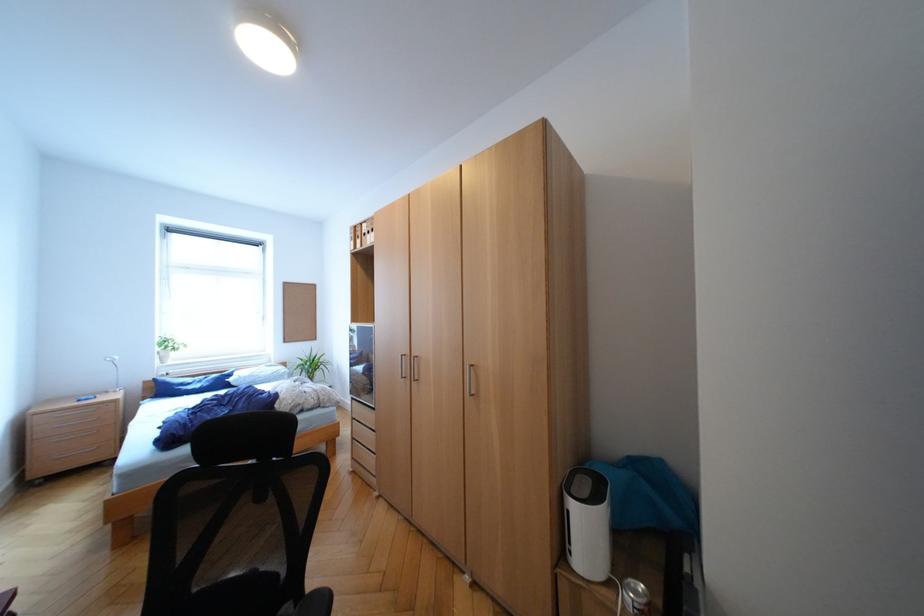
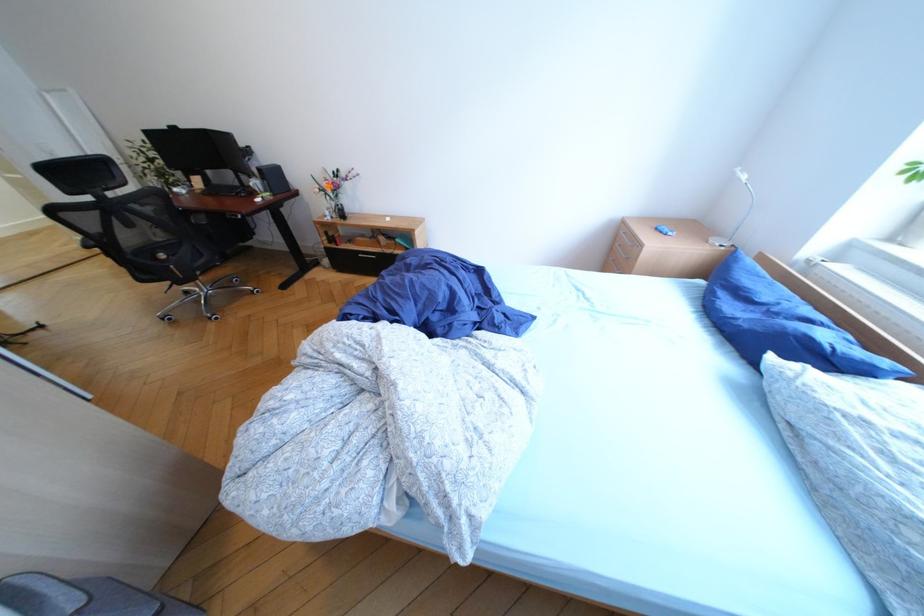
The point at (222, 383) is marked in the first image. Where is the corresponding point in the second image?

(768, 330)